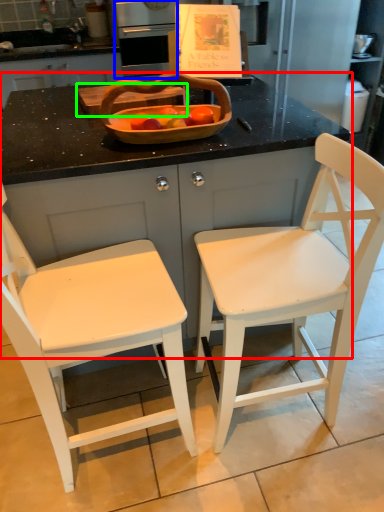
Question: Based on their relative distances, which object is nearer to counter (highlighted by a red box)? Choose from kitchen appliance (highlighted by a blue box) and cutting board (highlighted by a green box).

Choices:
 (A) kitchen appliance
 (B) cutting board

Answer: (B)